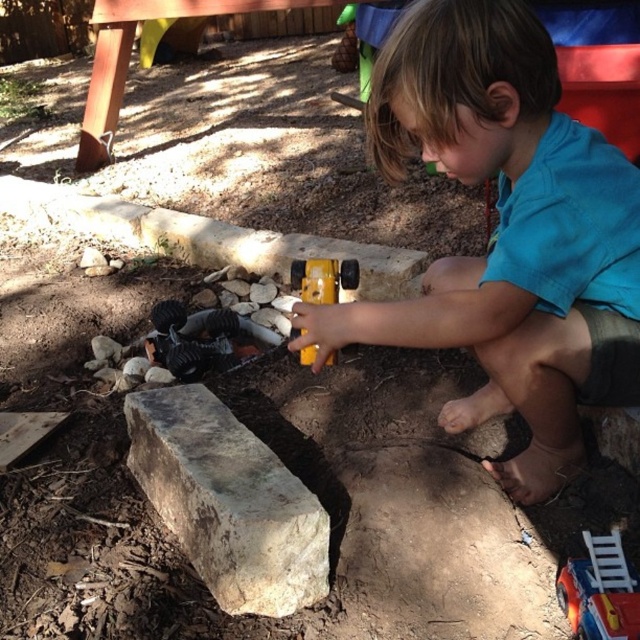
What is located at the coordinates point (506, 234)?

The blue matte shirt at center is located at point (506, 234).

You are a parent trying to ensure your child stays focused on their toy. The gray rough stone at center and the metallic silver toy truck at lower right are both in the child playing area. Which object is positioned higher relative to the other?

The gray rough stone at center is positioned above the metallic silver toy truck at lower right.

You are a drone operator trying to capture a photo of the child and the wooden structure in the backyard. The child is at point (508, 28) and the wooden structure is at point (600, 621). From your current position, which point should you prioritize capturing first to ensure both are in frame?

Point (508, 28) should be prioritized first because it is in front of point (600, 621), making it easier to frame both subjects without obstruction.